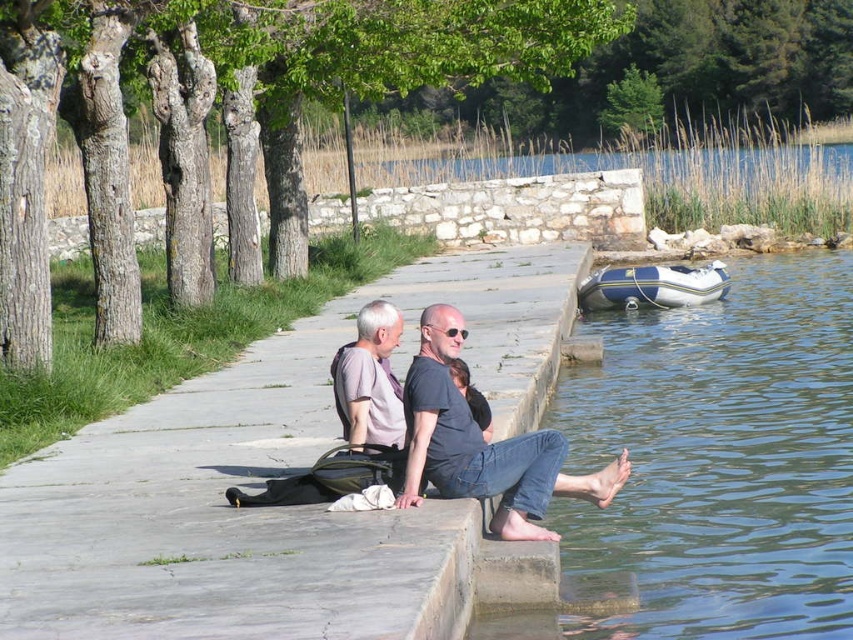
Question: Which object is closer to the camera taking this photo?

Choices:
 (A) gray concrete pavement at center
 (B) white rubber boat at lower right
 (C) blue rubber boat at lower left

Answer: (A)

Question: Which point is farther from the camera taking this photo?

Choices:
 (A) (370, 625)
 (B) (796, 460)
 (C) (537, 502)
 (D) (403, 460)

Answer: (B)

Question: Does blue rubber boat at lower left have a larger size compared to white rubber boat at lower right?

Choices:
 (A) yes
 (B) no

Answer: (A)

Question: Does gray concrete pavement at center come behind matte gray shirt at center?

Choices:
 (A) yes
 (B) no

Answer: (B)

Question: Which point is closer to the camera taking this photo?

Choices:
 (A) (708, 272)
 (B) (456, 440)

Answer: (B)

Question: Is matte gray shirt at center positioned at the back of gray fabric shirt at center?

Choices:
 (A) yes
 (B) no

Answer: (B)